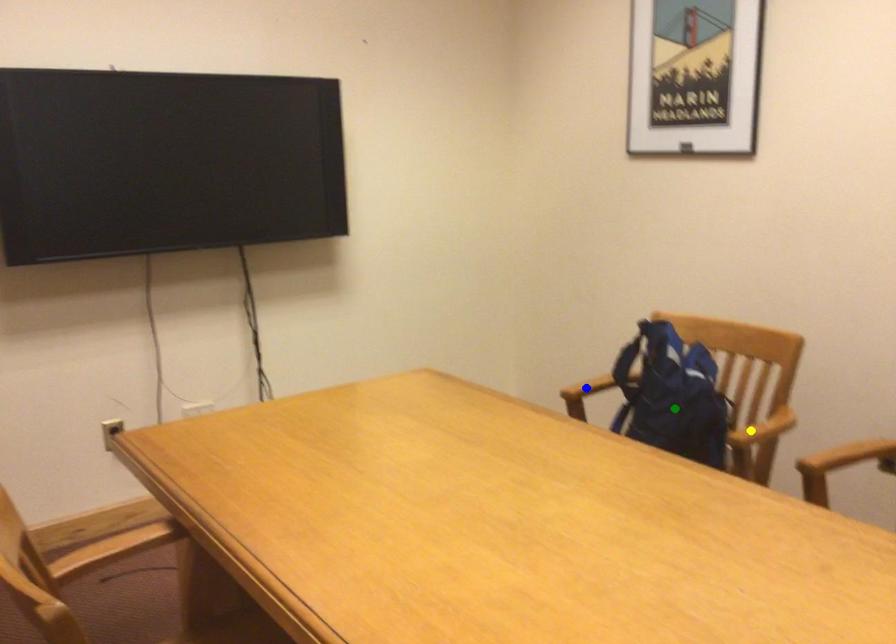
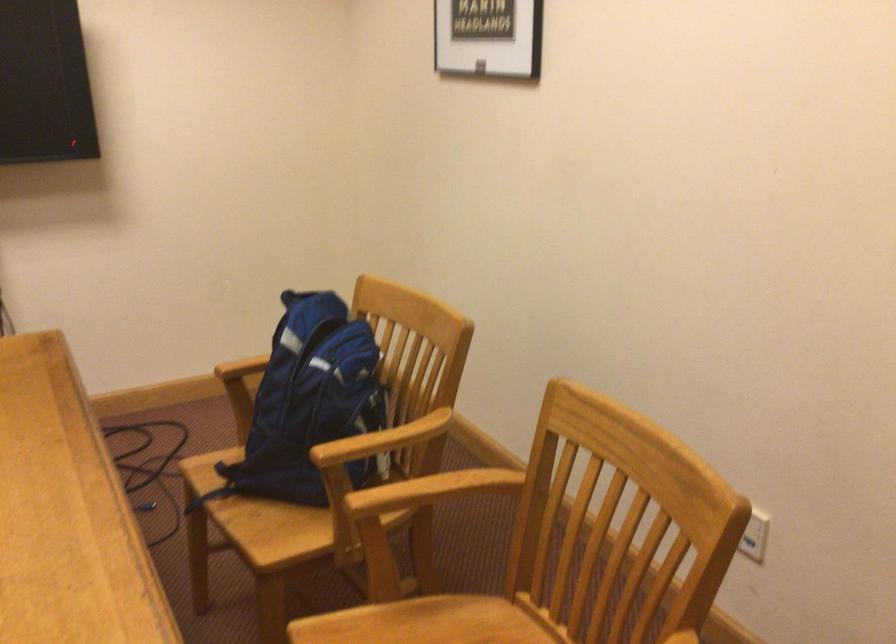
I am providing you with two images of the same scene from different viewpoints. Three points are marked in image1. Which point corresponds to a part or object that is occluded in image2?In image1, three points are marked. Which of them correspond to a part or object that is occluded in image2?Among the three points shown in image1, which one corresponds to a part or object that is no longer visible due to occlusion in image2?

blue point cannot be seen in image2.